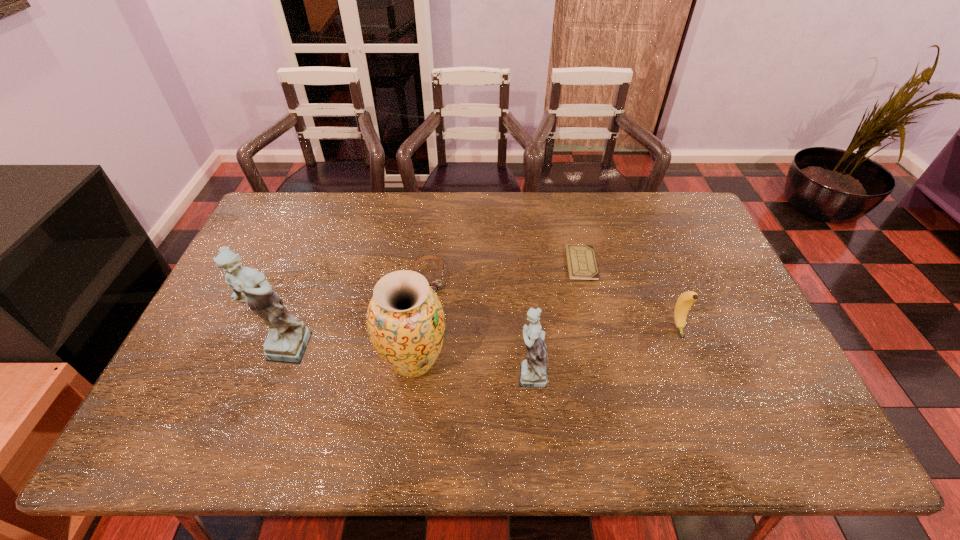
This screenshot has height=540, width=960. I want to click on vacant space that is in between the rightmost object and the leftmost object, so click(480, 339).

I want to click on vacant space that's between the rightmost object and the right figurine, so click(604, 350).

Locate which object is the second closest to the left figurine. Please provide its 2D coordinates. Your answer should be formatted as a tuple, i.e. [(x, y)], where the tuple contains the x and y coordinates of a point satisfying the conditions above.

[(435, 285)]

Locate an element on the screen. object that can be found as the closest to the banana is located at coordinates (581, 262).

You are a GUI agent. You are given a task and a screenshot of the screen. Output one action in this format:
    pyautogui.click(x=<x>, y=<y>)
    Task: Click on the vacant space that satisfies the following two spatial constraints: 1. on the back side of the vase; 2. on the left side of the second object from right to left
    
    Given the screenshot: What is the action you would take?
    pyautogui.click(x=426, y=264)